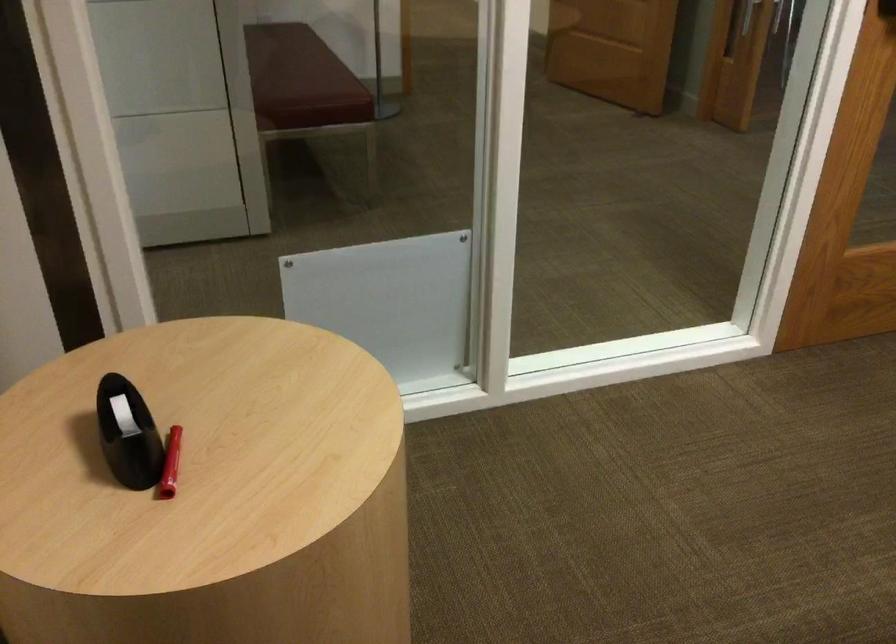
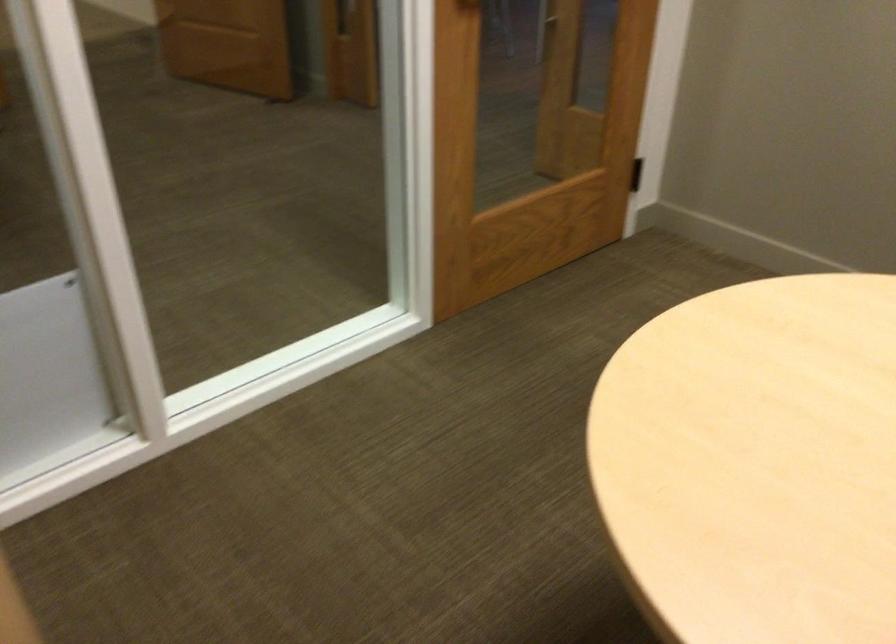
Question: The camera is either moving clockwise (left) or counter-clockwise (right) around the object. The first image is from the beginning of the video and the second image is from the end. Is the camera moving left or right when shooting the video?

Choices:
 (A) Left
 (B) Right

Answer: (A)